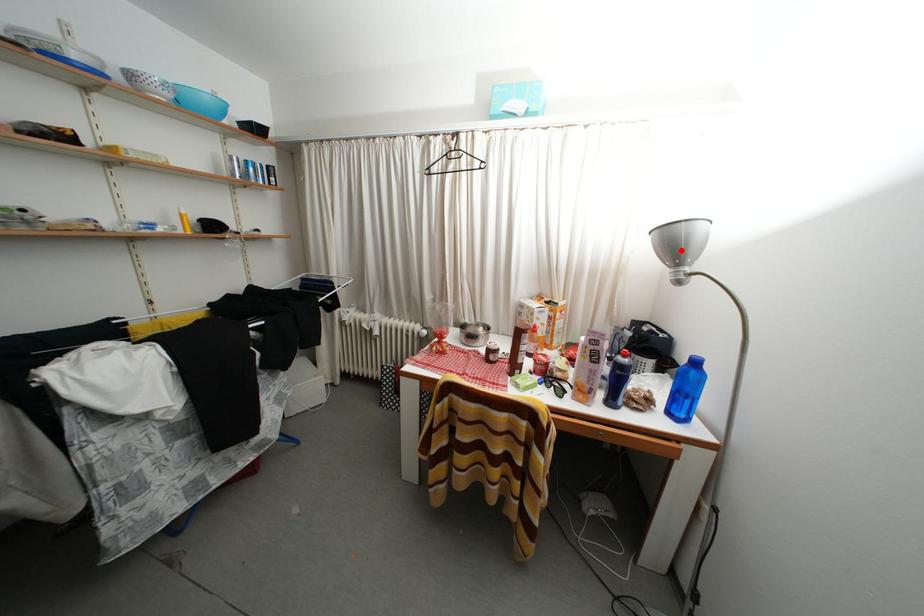
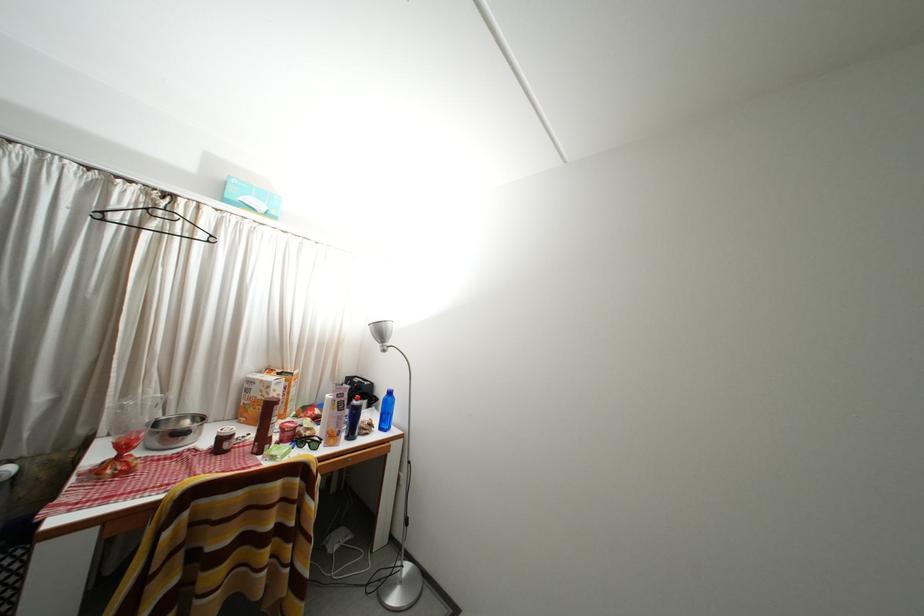
In the second image, find the point that corresponds to the highlighted location in the first image.

(388, 338)